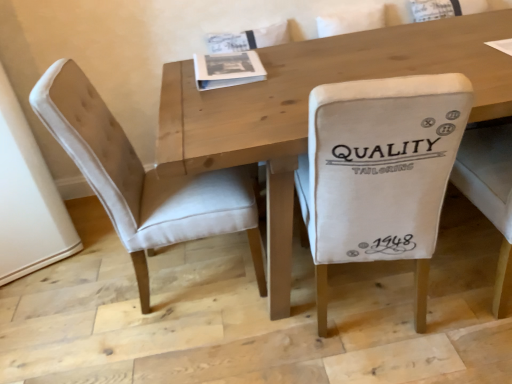
Find the location of a particular element. vacant space positioned to the left of beige fabric chair at left, the 1th chair in the left-to-right sequence is located at coordinates (77, 315).